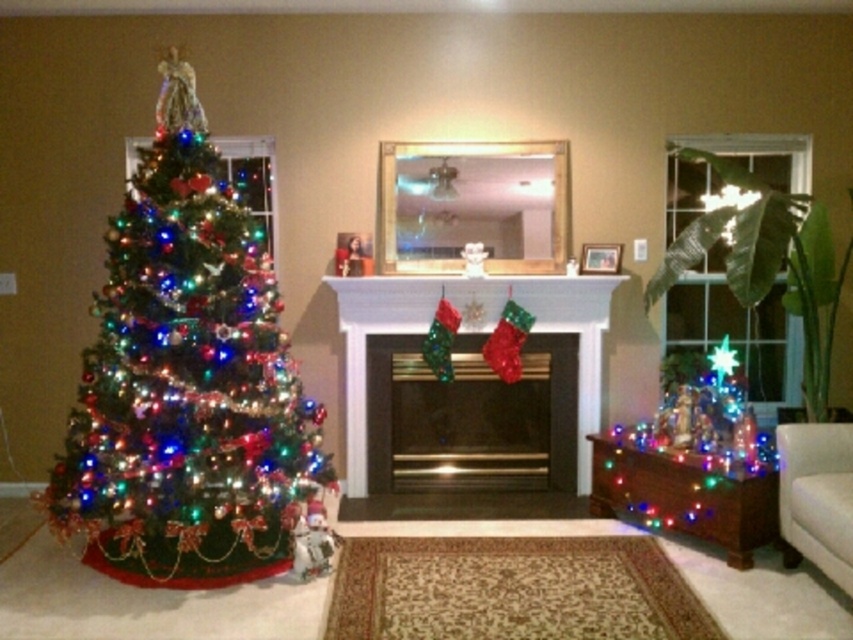
Question: Can you confirm if shiny green christmas tree at left is positioned below white glossy fireplace at center?

Choices:
 (A) yes
 (B) no

Answer: (B)

Question: Which point is farther to the camera?

Choices:
 (A) (811, 381)
 (B) (573, 410)
 (C) (299, 449)
 (D) (538, 342)

Answer: (B)

Question: Considering the relative positions of shiny green christmas tree at left and white glossy fireplace at center in the image provided, where is shiny green christmas tree at left located with respect to white glossy fireplace at center?

Choices:
 (A) right
 (B) left

Answer: (B)

Question: Which point is closer to the camera?

Choices:
 (A) metallic gold fireplace at center
 (B) green leafy plant at right
 (C) shiny green christmas tree at left

Answer: (B)

Question: Does metallic gold fireplace at center appear under green leafy plant at right?

Choices:
 (A) no
 (B) yes

Answer: (B)

Question: Which is nearer to the shiny green christmas tree at left?

Choices:
 (A) white glossy fireplace at center
 (B) metallic gold fireplace at center
 (C) green leafy plant at right

Answer: (A)